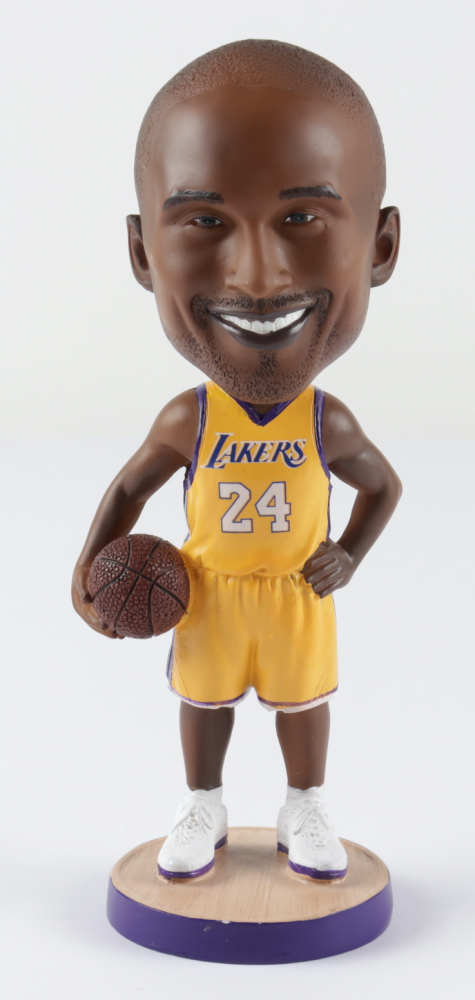
Find the location of `wood base of bobble head figure`. wood base of bobble head figure is located at coordinates (255, 902).